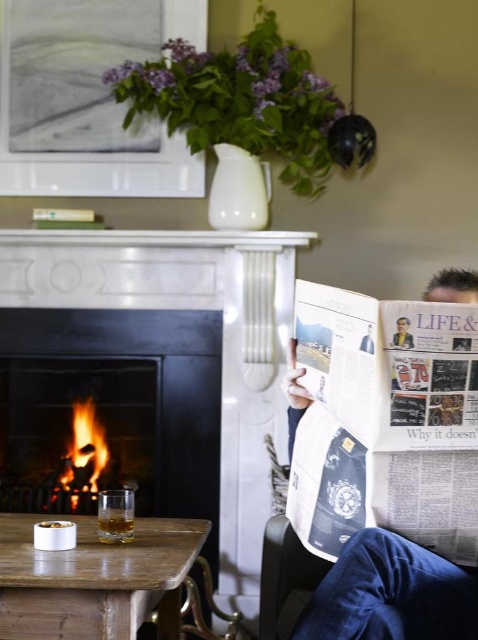
Based on the photo, you are standing in the living room and want to place a new decorative item on the closest object to you between the black metal fireplace at left and the wooden table at lower left. Which object should you choose?

You should choose the black metal fireplace at left because it is closer to you than the wooden table at lower left.

You are standing in the living room looking at the fireplace. There is a point marked at coordinates (115, 404). What object is located at that point?

The point at coordinates (115, 404) corresponds to the black metal fireplace at left.

You are standing in front of the fireplace and want to place a 3.5 meter long decorative banner from the black metal fireplace at left to the opposite wall. Is the banner long enough to reach the wall?

The distance between the black metal fireplace at left and the viewer is 2.97 meters. The banner is 3.5 meters long, so it is long enough to reach the wall.